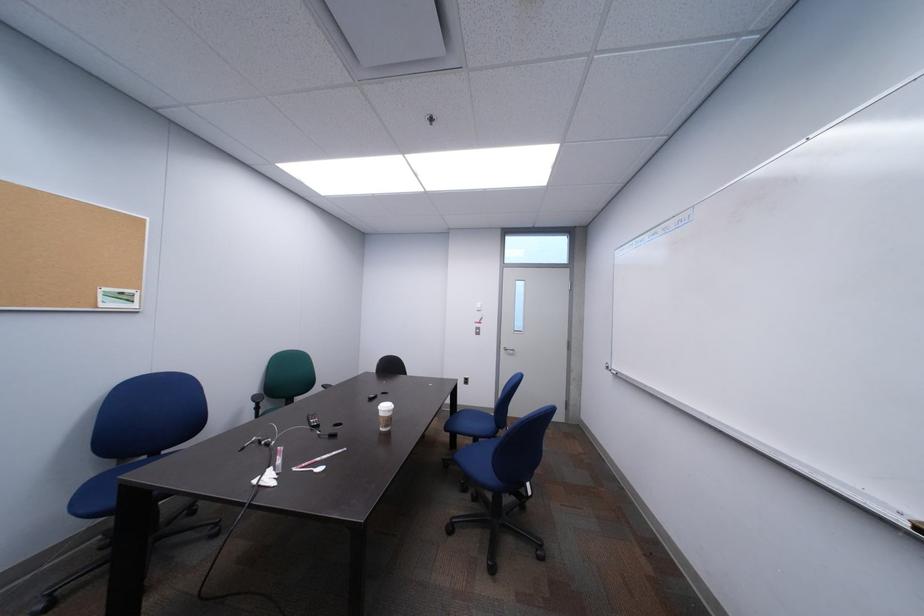
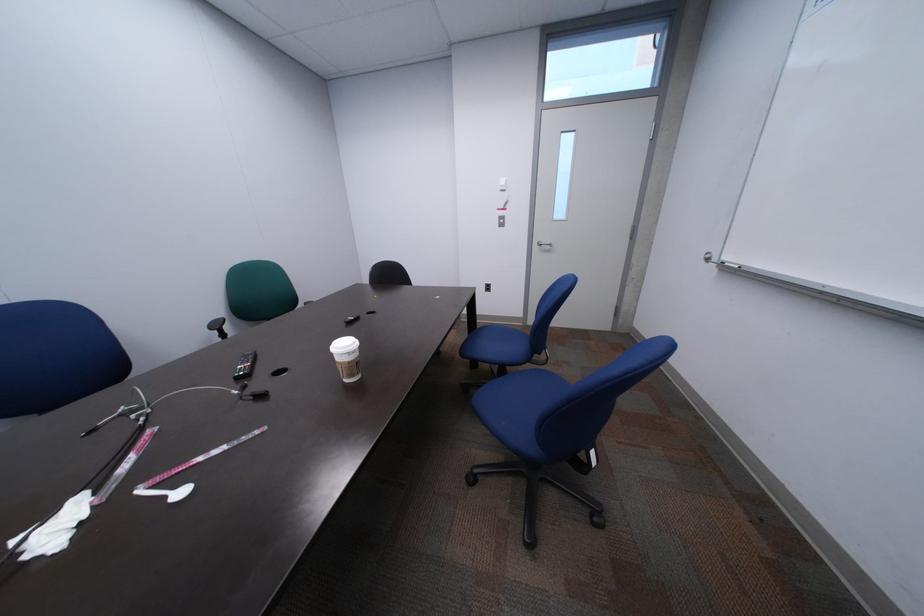
Question: In a continuous first-person perspective shot, in which direction is the camera moving?

Choices:
 (A) Left
 (B) Right
 (C) Forward
 (D) Backward

Answer: (C)